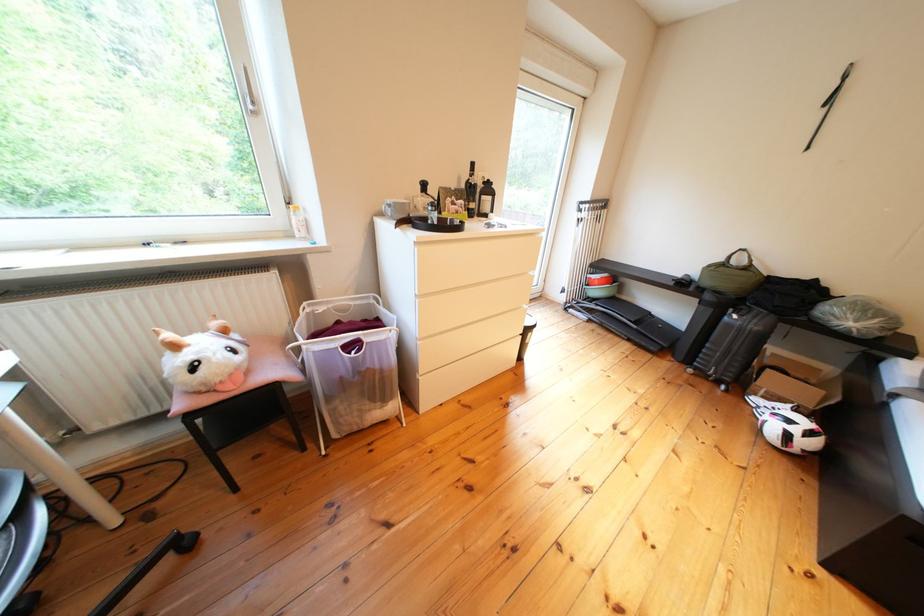
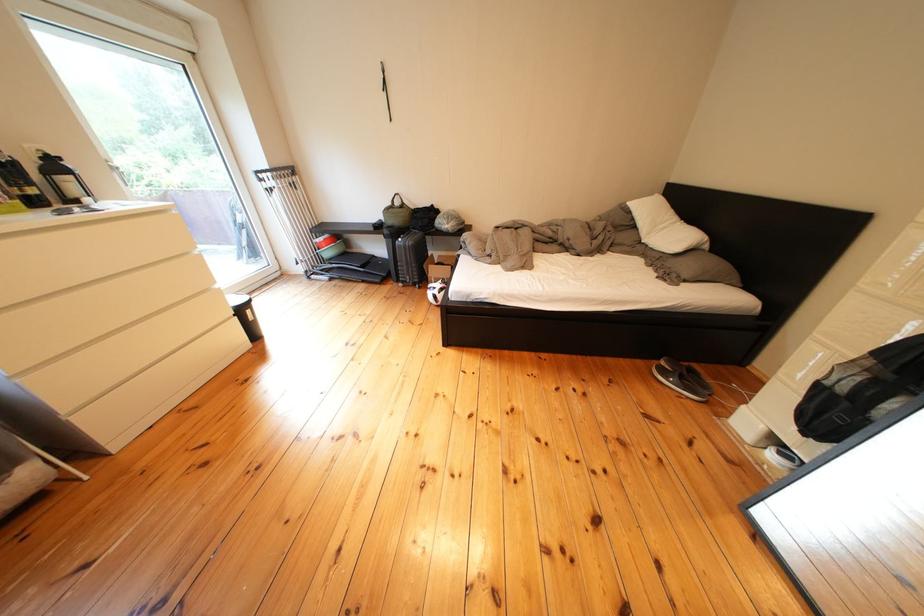
In the second image, find the point that corresponds to point (732, 387) in the first image.

(429, 290)